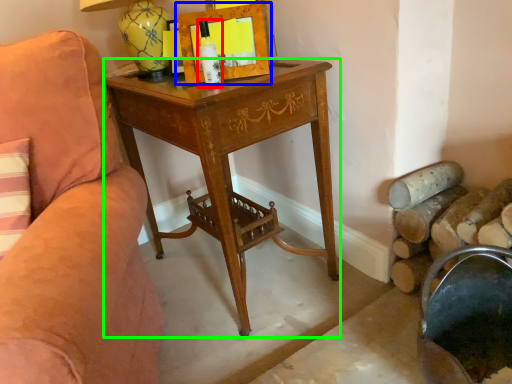
Question: Considering the real-world distances, which object is closest to bottle (highlighted by a red box)? picture frame (highlighted by a blue box) or desk (highlighted by a green box).

Choices:
 (A) picture frame
 (B) desk

Answer: (A)